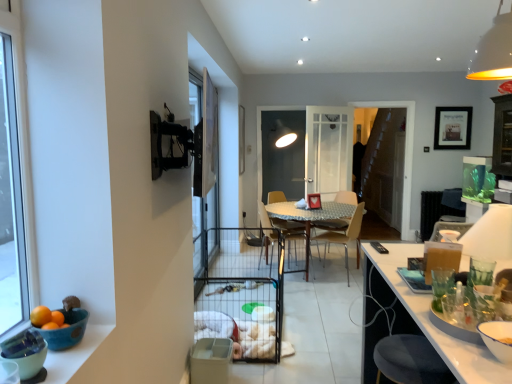
Question: From the image's perspective, relative to blue ceramic bowl at lower left, which is the second bowl in front-to-back order, is light brown wood chair at center, acting as the first chair starting from the right, above or below?

Choices:
 (A) below
 (B) above

Answer: (A)

Question: Based on their sizes in the image, would you say light brown wood chair at center, the second chair from the back, is bigger or smaller than blue ceramic bowl at lower left, which is the second bowl in front-to-back order?

Choices:
 (A) big
 (B) small

Answer: (A)

Question: Estimate the real-world distances between objects in this image. Which object is farther from the orange matte at left?

Choices:
 (A) metallic silver table at center
 (B) clear glass screen door at center, positioned as the first screen door in front-to-back order
 (C) blue ceramic bowl at lower left, the first bowl positioned from the back
 (D) green matte bowl at lower left, which is the 2th bowl from back to front
 (E) wooden chair at center, which is counted as the first chair, starting from the back

Answer: (E)

Question: Which of these objects is positioned closest to the wooden chair at center, which is the first chair from left to right?

Choices:
 (A) clear glass screen door at center, positioned as the 2th screen door in right-to-left order
 (B) blue ceramic bowl at lower left, which is the second bowl in front-to-back order
 (C) wooden framed picture at upper right
 (D) light brown wood chair at center, the second chair from the back
 (E) green matte bowl at lower left, which is counted as the 1th bowl, starting from the front

Answer: (D)